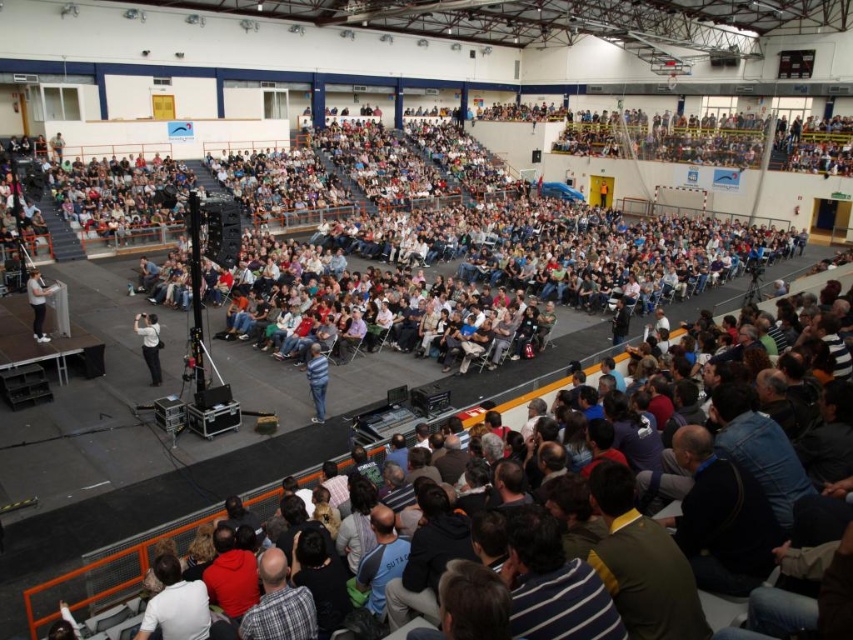
You are standing at the back of the sports hall and see both the white matte shirt at center and the white fabric shirt at left. Which one is closer to you?

The white matte shirt at center is closer to you since it is only 13.39 feet away from the white fabric shirt at left, but since you are at the back, the shirt at center would be nearer.

Looking at this image, you are an event organizer who needs to ensure that all attendees have a clear view of the stage. You notice two shirts in the crowd, the white matte shirt at center and the white fabric shirt at left. Which of these shirts might belong to someone sitting closer to the front of the venue?

The white matte shirt at center is larger in size than the white fabric shirt at left. Since larger objects appear closer when viewed from a distance, the white matte shirt at center likely belongs to someone sitting closer to the front of the venue.